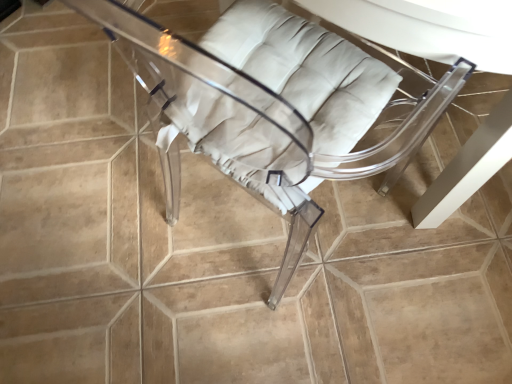
At what (x,y) coordinates should I click in order to perform the action: click on vacant area that lies in front of clear acrylic chair at center. Please return your answer as a coordinate pair (x, y). This screenshot has width=512, height=384. Looking at the image, I should click on 272,337.